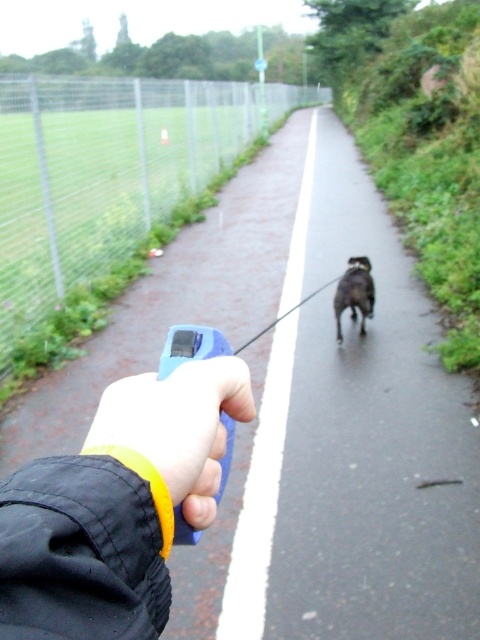
You are a photographer trying to capture a closeup of the yellow rubber wristband at lower center without including the black rubber leash at center in the frame. Based on their relative heights, can you position your camera so that the leash is out of sight?

The black rubber leash at center is taller than the yellow rubber wristband at lower center. Since the leash is taller, positioning the camera lower might allow the wristband to be visible while the leash is out of frame. However, since the leash is in the foreground and central, it might still block the wristband depending on the angle.

You are holding the black rubber leash at center and want to throw a ball to your dog. The ball is currently on the metal fence at left. Can you reach the ball without moving from your current position?

The black rubber leash at center is closer to the viewer than the metal fence at left, so the metal fence at left is farther away. Since the ball is on the metal fence at left, you cannot reach it without moving closer.

You are standing on the path and want to throw a ball to your dog. You have two options for where to throw it. The first option is to the location marked by point [324,500] and the second is to point [146,218]. Which point is closer to you?

Point [324,500] is closer to the camera than point [146,218], so you should throw the ball to point [324,500] since it is closer to you.